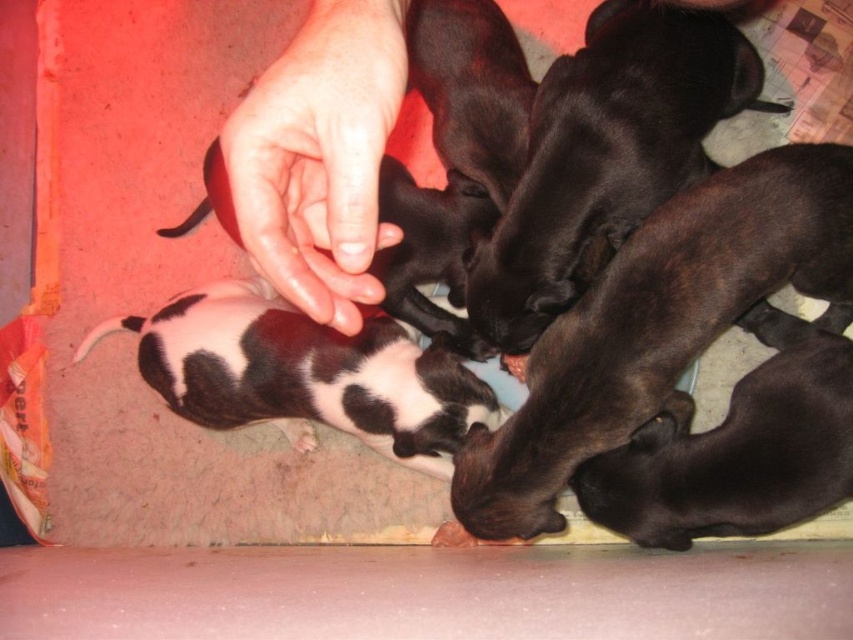
You are a veterinarian examining the image of the puppies. Where is the black matte dog at center positioned in relation to the blue container they are eating from?

The black matte dog at center is located at point (659,323), which would place it near the center of the image, likely close to the blue container they are eating from.